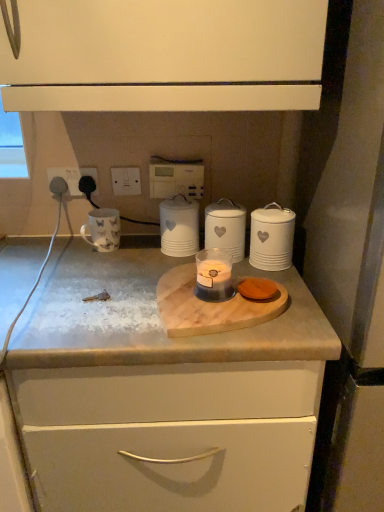
This screenshot has width=384, height=512. I want to click on free space to the right of white glossy mug at left, so click(144, 252).